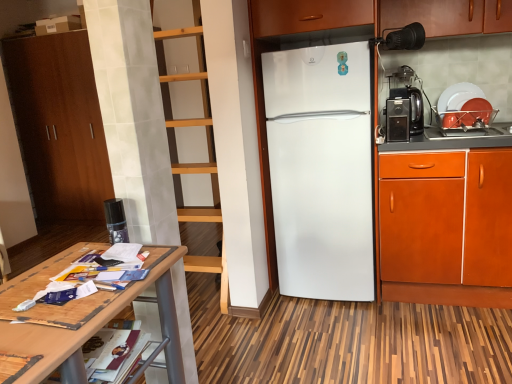
Question: Does brown wood cabinet at left, which is the second cabinetry in front-to-back order, appear on the left side of orange wood cabinet at right, arranged as the 1th cabinetry when viewed from the right?

Choices:
 (A) yes
 (B) no

Answer: (A)

Question: Does brown wood cabinet at left, acting as the first cabinetry starting from the left, have a greater height compared to orange wood cabinet at right, positioned as the first cabinetry in front-to-back order?

Choices:
 (A) no
 (B) yes

Answer: (B)

Question: Is brown wood cabinet at left, which is counted as the 2th cabinetry, starting from the right, positioned far away from orange wood cabinet at right, positioned as the first cabinetry in front-to-back order?

Choices:
 (A) no
 (B) yes

Answer: (B)

Question: Considering the relative positions of brown wood cabinet at left, which is counted as the 2th cabinetry, starting from the right, and orange wood cabinet at right, positioned as the first cabinetry in front-to-back order, in the image provided, is brown wood cabinet at left, which is counted as the 2th cabinetry, starting from the right, to the right of orange wood cabinet at right, positioned as the first cabinetry in front-to-back order, from the viewer's perspective?

Choices:
 (A) yes
 (B) no

Answer: (B)

Question: Can you confirm if brown wood cabinet at left, which is counted as the 2th cabinetry, starting from the right, is shorter than orange wood cabinet at right, the second cabinetry viewed from the back?

Choices:
 (A) yes
 (B) no

Answer: (B)

Question: Based on their sizes in the image, would you say black plastic toaster at right, marked as the second appliance in a left-to-right arrangement, is bigger or smaller than brown wood cabinet at left, positioned as the first cabinetry in back-to-front order?

Choices:
 (A) big
 (B) small

Answer: (B)

Question: Visually, is black plastic toaster at right, which is the 2th appliance in front-to-back order, positioned to the left or to the right of brown wood cabinet at left, which is counted as the 2th cabinetry, starting from the right?

Choices:
 (A) left
 (B) right

Answer: (B)

Question: In terms of width, does black plastic toaster at right, the 2th appliance from the top, look wider or thinner when compared to brown wood cabinet at left, acting as the first cabinetry starting from the left?

Choices:
 (A) thin
 (B) wide

Answer: (A)

Question: From a real-world perspective, is black plastic toaster at right, the 2th appliance from the top, physically located above or below brown wood cabinet at left, acting as the first cabinetry starting from the left?

Choices:
 (A) below
 (B) above

Answer: (B)

Question: Considering the positions of black plastic toaster at right, which is the 2th appliance from bottom to top, and black plastic coffee machine at right in the image, is black plastic toaster at right, which is the 2th appliance from bottom to top, taller or shorter than black plastic coffee machine at right?

Choices:
 (A) short
 (B) tall

Answer: (A)

Question: Is black plastic toaster at right, which is the 2th appliance in front-to-back order, in front of or behind black plastic coffee machine at right in the image?

Choices:
 (A) front
 (B) behind

Answer: (A)

Question: From the image's perspective, is black plastic toaster at right, which is the 2th appliance in front-to-back order, positioned above or below black plastic coffee machine at right?

Choices:
 (A) above
 (B) below

Answer: (B)

Question: Is point (392, 125) closer or farther from the camera than point (417, 130)?

Choices:
 (A) farther
 (B) closer

Answer: (B)

Question: From the image's perspective, relative to black plastic toaster at right, the 2th appliance from the top, is white matte refrigerator at center above or below?

Choices:
 (A) above
 (B) below

Answer: (B)

Question: From a real-world perspective, is white matte refrigerator at center physically located above or below black plastic toaster at right, which appears as the 2th appliance when viewed from the right?

Choices:
 (A) above
 (B) below

Answer: (B)